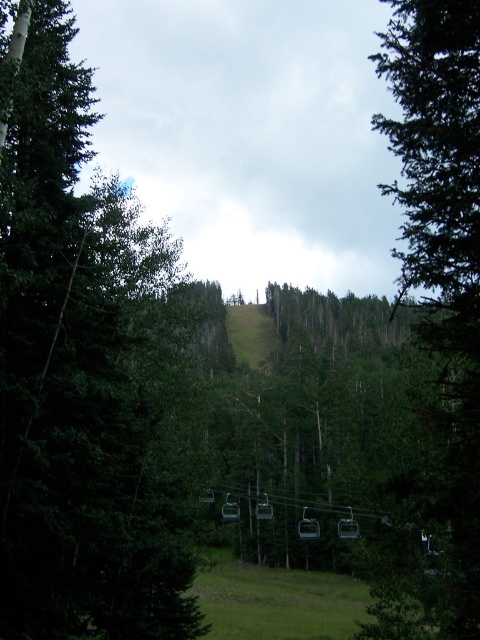
You are standing at the base of the green grassy ski slope at center and want to reach the top. The green matte tree at center is in your path. Can you walk around the tree without leaving the slope?

The green matte tree at center is taller than the green grassy ski slope at center, so it is possible to walk around the tree without leaving the slope since the tree is elevated higher than the slope.